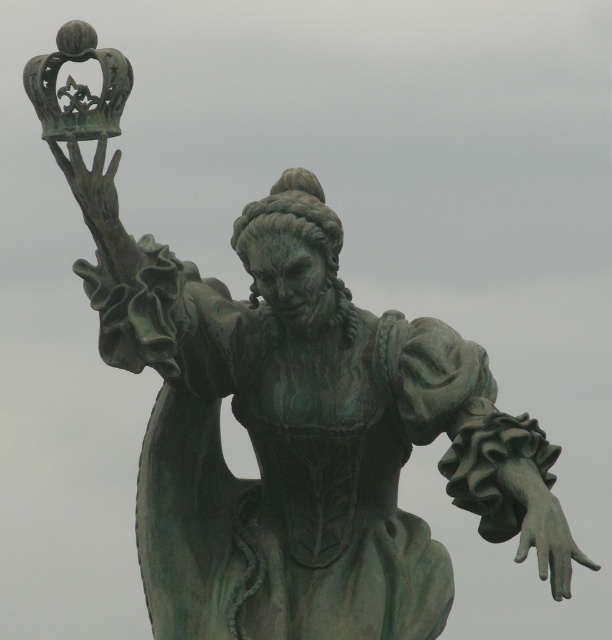
Does green patina hand at lower right have a lesser width compared to green patina crown at upper left?

Indeed, green patina hand at lower right has a lesser width compared to green patina crown at upper left.

Which is more to the left, green patina hand at lower right or green patina crown at upper left?

From the viewer's perspective, green patina crown at upper left appears more on the left side.

Image resolution: width=612 pixels, height=640 pixels. Describe the element at coordinates (545, 531) in the screenshot. I see `green patina hand at lower right` at that location.

Locate an element on the screen. green patina hand at lower right is located at coordinates pyautogui.click(x=545, y=531).